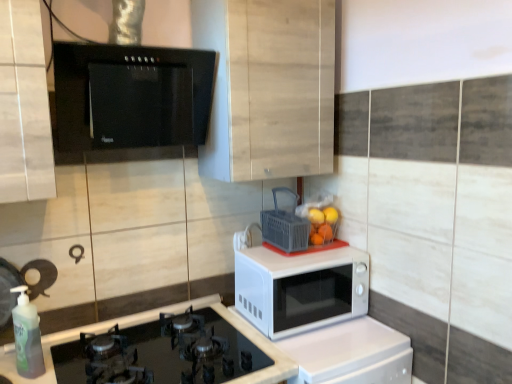
Question: From their relative heights in the image, would you say white glossy microwave at center is taller or shorter than gray plastic basket at center?

Choices:
 (A) tall
 (B) short

Answer: (A)

Question: From a real-world perspective, is white glossy microwave at center above or below gray plastic basket at center?

Choices:
 (A) below
 (B) above

Answer: (A)

Question: Which of these objects is positioned closest to the green translucent bottle at lower left?

Choices:
 (A) black glass range hood at upper center
 (B) black glass gas stove at lower left
 (C) white glossy microwave at center
 (D) orange matte at upper right, positioned as the first orange in left-to-right order
 (E) light wood cabinet at upper center

Answer: (B)

Question: Which of these objects is positioned closest to the green translucent bottle at lower left?

Choices:
 (A) gray plastic basket at center
 (B) black glass range hood at upper center
 (C) orange matte at upper right, which ranks as the 2th orange in left-to-right order
 (D) white matte microwave at center
 (E) light wood cabinet at upper center

Answer: (B)